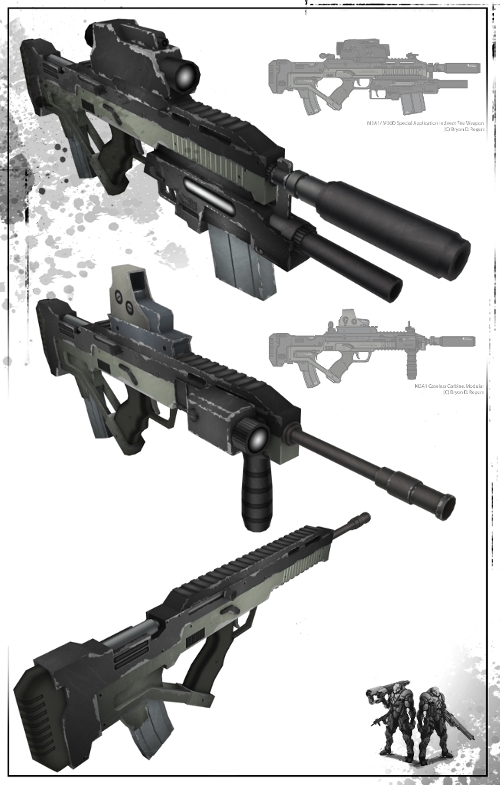
The width and height of the screenshot is (500, 785). I want to click on magazine, so click(x=154, y=727), click(x=238, y=265), click(x=311, y=375), click(x=408, y=104).